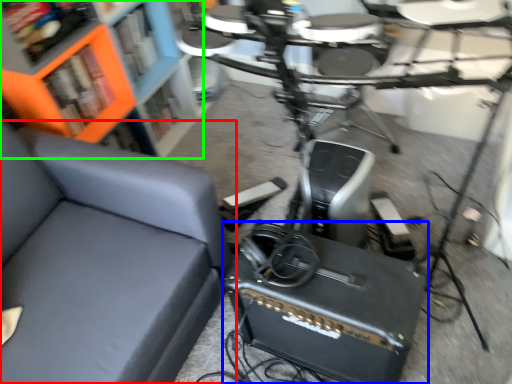
Question: Which is nearer to the chair (highlighted by a red box)? speaker (highlighted by a blue box) or bookcase (highlighted by a green box).

Choices:
 (A) speaker
 (B) bookcase

Answer: (A)